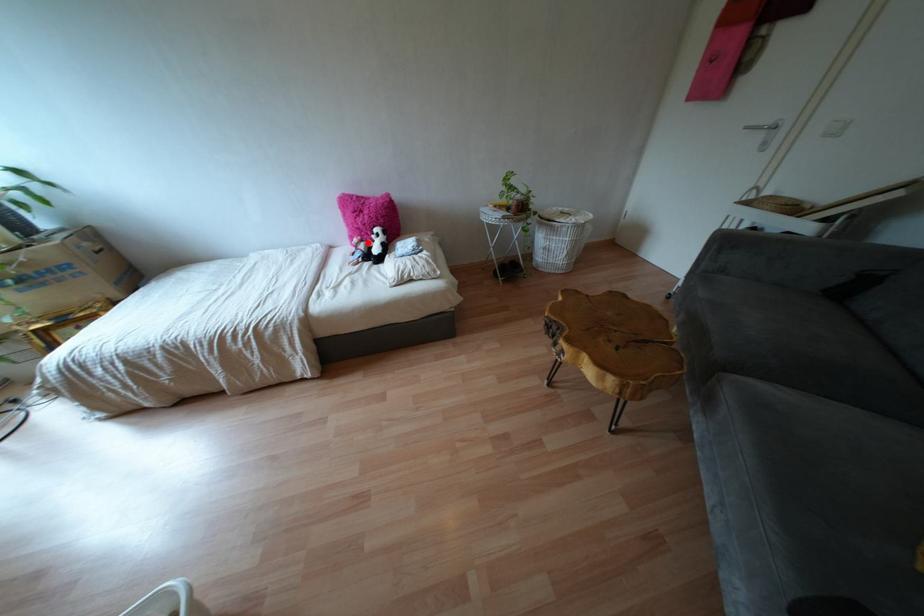
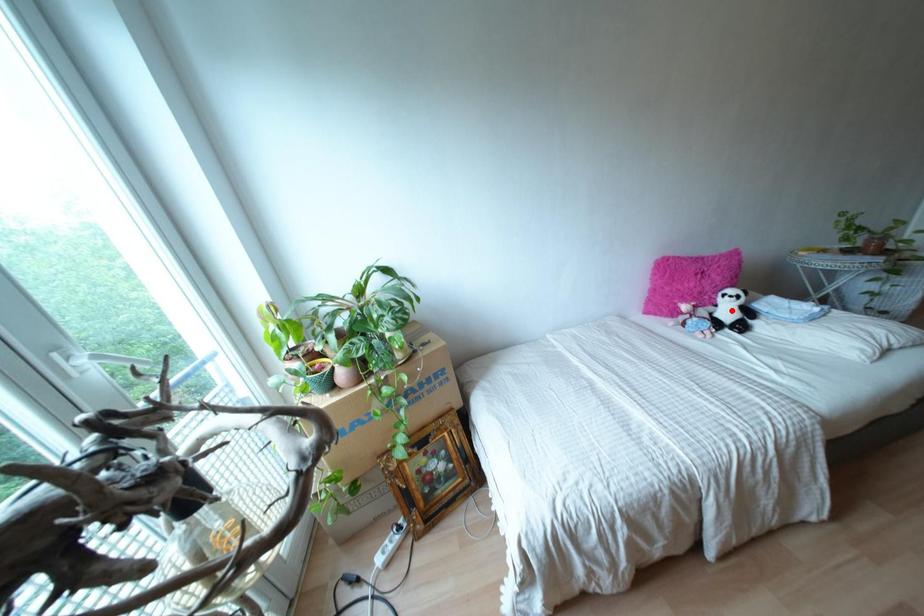
I am providing you with two images of the same scene from different viewpoints. A red point is marked on the first image and another point is marked on the second image. Is the red point in image1 aligned with the point shown in image2?

No